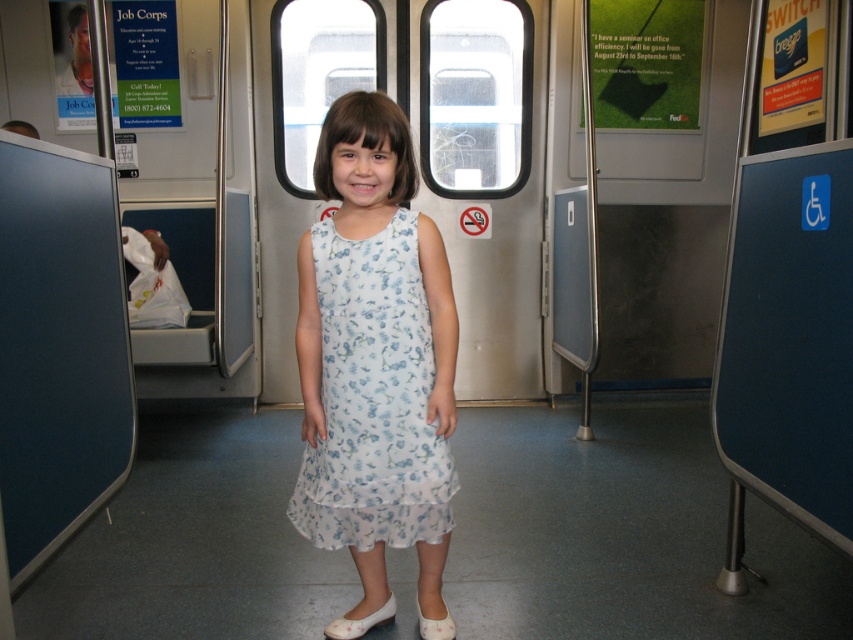
Question: Does white floral dress at center have a smaller size compared to white fabric shoe at lower center?

Choices:
 (A) yes
 (B) no

Answer: (B)

Question: Considering the real-world distances, which object is farthest from the white fabric shoe at lower center?

Choices:
 (A) white floral dress at center
 (B) white satin shoe at lower center

Answer: (A)

Question: Which point is farther to the camera?

Choices:
 (A) (401, 237)
 (B) (439, 628)

Answer: (B)

Question: Does white floral dress at center appear on the right side of white fabric shoe at lower center?

Choices:
 (A) no
 (B) yes

Answer: (A)

Question: Which object is farther from the camera taking this photo?

Choices:
 (A) white floral dress at center
 (B) white satin shoe at lower center
 (C) white fabric shoe at lower center

Answer: (B)

Question: Does white floral dress at center lie in front of white fabric shoe at lower center?

Choices:
 (A) no
 (B) yes

Answer: (B)